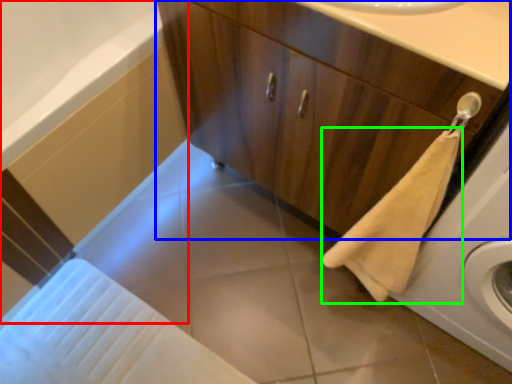
Question: Which object is positioned closest to bath (highlighted by a red box)? Select from bathroom cabinet (highlighted by a blue box) and bath towel (highlighted by a green box).

Choices:
 (A) bathroom cabinet
 (B) bath towel

Answer: (A)